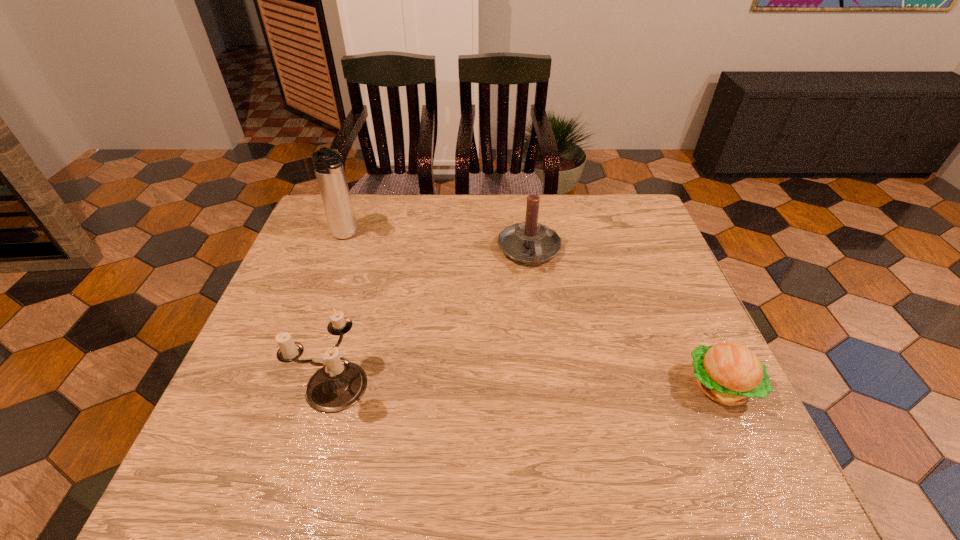
This screenshot has height=540, width=960. I want to click on object that is at the far left corner, so click(328, 166).

I want to click on object located at the near left corner, so click(x=339, y=384).

Find the location of a particular element. The height and width of the screenshot is (540, 960). object present at the near right corner is located at coordinates (729, 373).

In the image, there is a desktop. Where is `vacant space at the far edge`? vacant space at the far edge is located at coordinates (404, 218).

Identify the location of vacant region at the left edge. (275, 373).

I want to click on blank space at the right edge of the desktop, so click(609, 249).

Locate an element on the screen. The height and width of the screenshot is (540, 960). vacant space at the far right corner of the desktop is located at coordinates (612, 217).

At what (x,y) coordinates should I click in order to perform the action: click on free space between the thermos bottle and the candle holder. Please return your answer as a coordinate pair (x, y). This screenshot has height=540, width=960. Looking at the image, I should click on (340, 310).

Where is `blank region between the rightmost object and the tallest object`? blank region between the rightmost object and the tallest object is located at coordinates (534, 310).

I want to click on empty location between the candle holder and the hamburger, so click(527, 385).